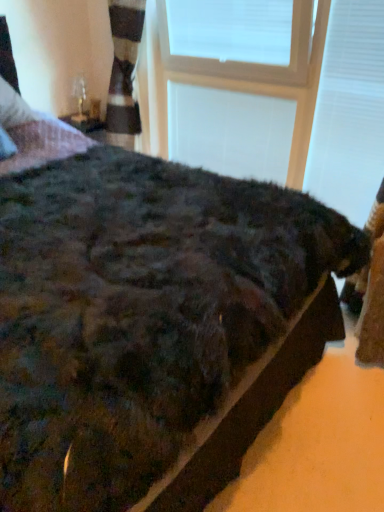
Question: Looking at their shapes, would you say clear glass table lamp at upper left is wider or thinner than white plastic window frame at upper center, acting as the second window frame starting from the front?

Choices:
 (A) thin
 (B) wide

Answer: (B)

Question: Considering the positions of clear glass table lamp at upper left and white plastic window frame at upper center, which appears as the 1th window frame when viewed from the back, in the image, is clear glass table lamp at upper left bigger or smaller than white plastic window frame at upper center, which appears as the 1th window frame when viewed from the back,?

Choices:
 (A) big
 (B) small

Answer: (B)

Question: Based on their relative distances, which object is nearer to the white plastic window frame at upper center, the 1th window frame from the front?

Choices:
 (A) clear glass table lamp at upper left
 (B) white plastic window frame at upper center, which appears as the 1th window frame when viewed from the back

Answer: (B)

Question: Considering the real-world distances, which object is closest to the white plastic window frame at upper center, the 1th window frame from the front?

Choices:
 (A) clear glass table lamp at upper left
 (B) white plastic window frame at upper center, which appears as the 1th window frame when viewed from the back

Answer: (B)